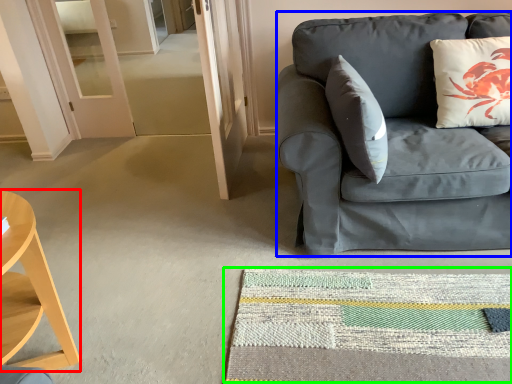
Question: Which object is positioned closest to desk (highlighted by a red box)? Select from studio couch (highlighted by a blue box) and mat (highlighted by a green box).

Choices:
 (A) studio couch
 (B) mat

Answer: (B)